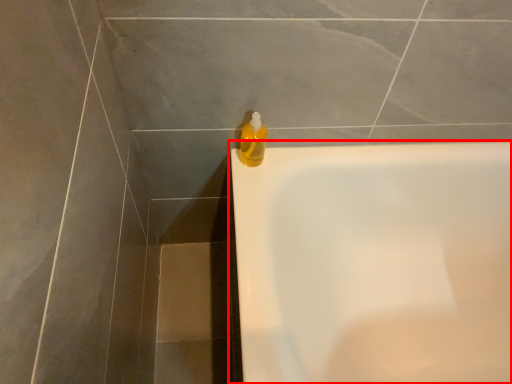
Question: From the image's perspective, where is bathtub (annotated by the red box) located in relation to cleaning product in the image?

Choices:
 (A) below
 (B) above

Answer: (A)